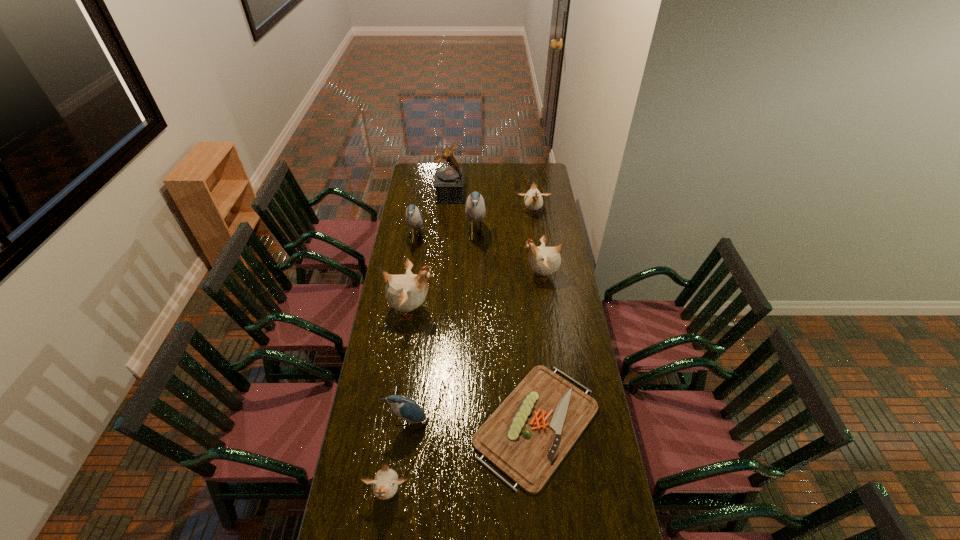
This screenshot has height=540, width=960. What are the coordinates of `phonograph_record` in the screenshot? It's located at (448, 181).

Locate an element on the screen. This screenshot has height=540, width=960. the fifth bird from left to right is located at coordinates (475, 209).

What are the coordinates of `the rightmost blue bird` in the screenshot? It's located at (475, 209).

At what (x,y) coordinates should I click in order to perform the action: click on the biggest white bird. Please return your answer as a coordinate pair (x, y). This screenshot has height=540, width=960. Looking at the image, I should click on (406, 292).

I want to click on the second smallest blue bird, so click(413, 217).

Locate an element on the screen. the third smallest white bird is located at coordinates (544, 260).

Locate an element on the screen. the third biggest white bird is located at coordinates (533, 200).

Identify the location of the smallest blue bird. (405, 408).

Where is `the nearest blue bird`? This screenshot has width=960, height=540. the nearest blue bird is located at coordinates (405, 408).

Locate an element on the screen. the nearest white bird is located at coordinates (385, 484).